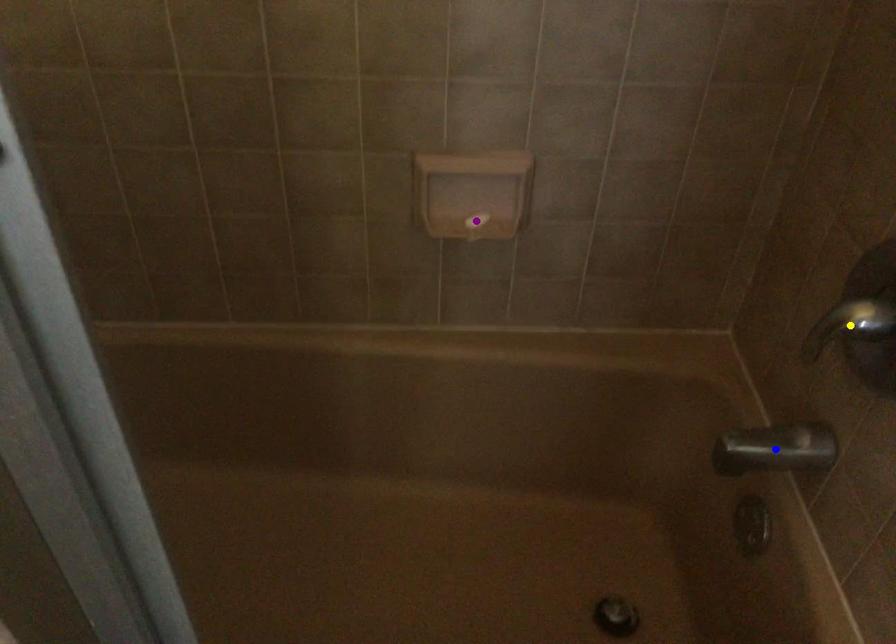
Consider the image. Order these from nearest to farthest:
purple point, yellow point, blue point

purple point → blue point → yellow point